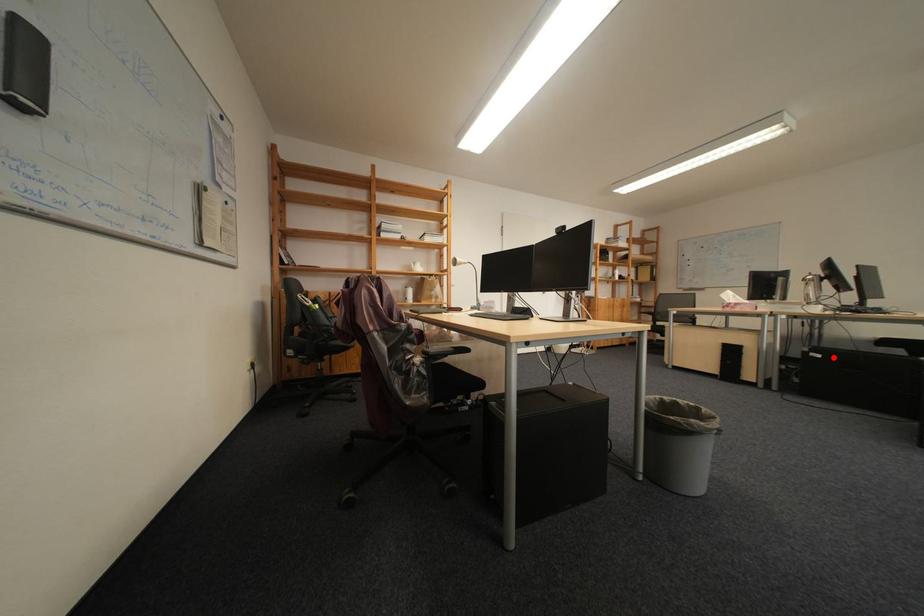
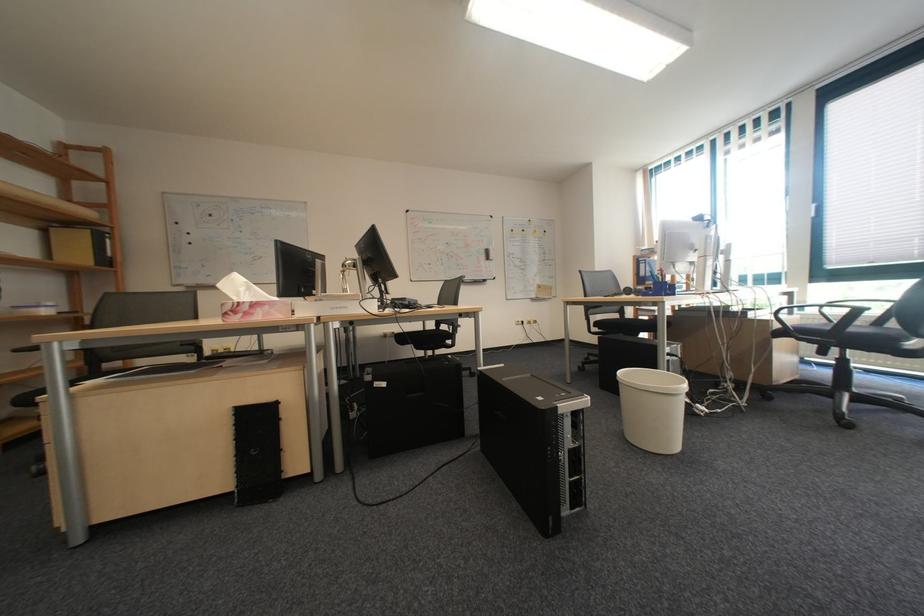
The point at the highlighted location is marked in the first image. Where is the corresponding point in the second image?

(398, 386)